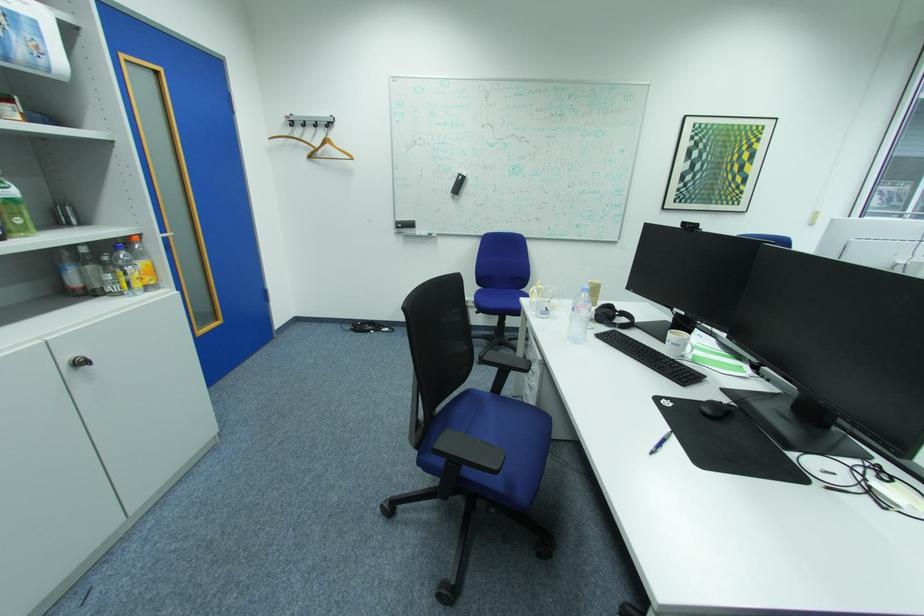
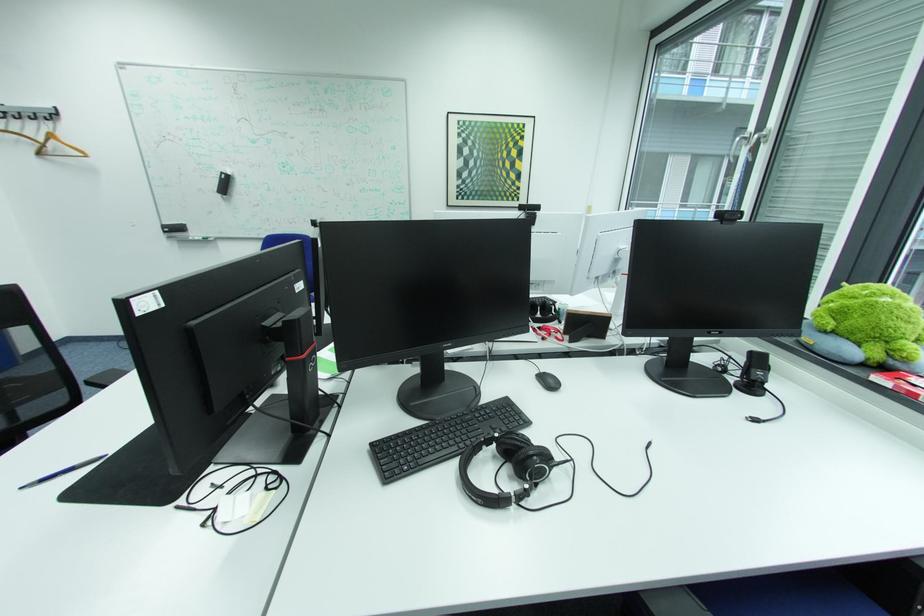
The point at (658, 453) is marked in the first image. Where is the corresponding point in the second image?

(32, 485)